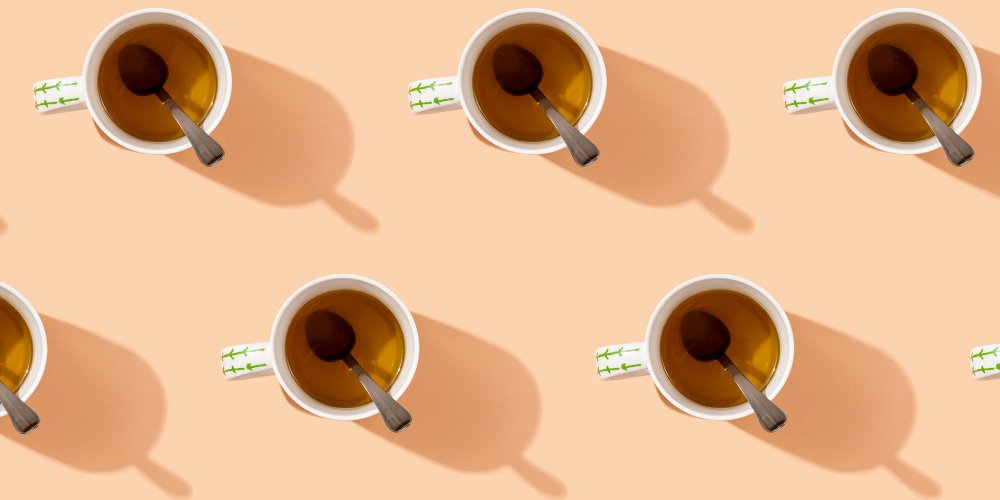
The image size is (1000, 500). Identify the location of mugs. 164,122, 38,359, 277,351, 483,124, 668,312, 869,134.